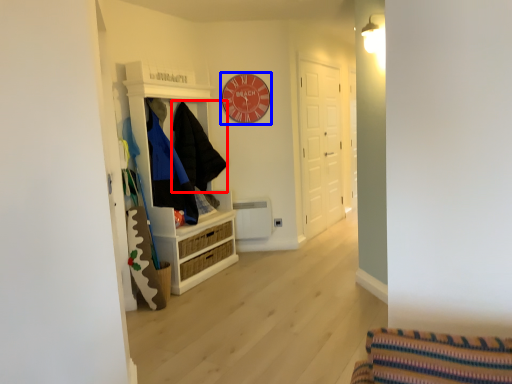
Question: Among these objects, which one is nearest to the camera, clothing (highlighted by a red box) or clock (highlighted by a blue box)?

Choices:
 (A) clothing
 (B) clock

Answer: (A)